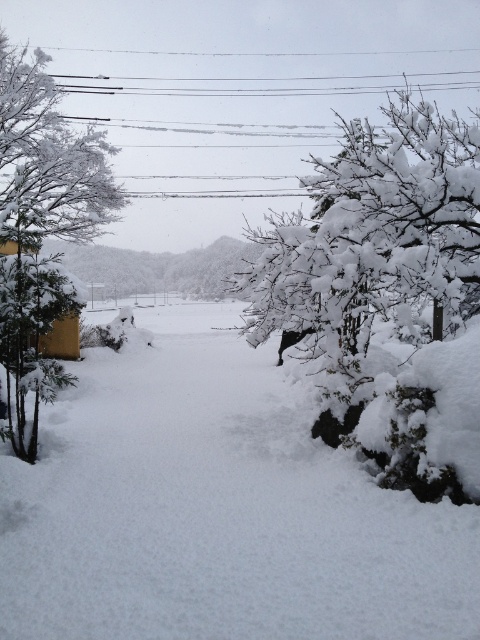
Where is `white fluffy snow at center`? The image size is (480, 640). white fluffy snow at center is located at coordinates (216, 509).

Does white fluffy snow at center have a smaller size compared to white frosty tree at left?

Correct, white fluffy snow at center occupies less space than white frosty tree at left.

Identify the location of white fluffy snow at center. The height and width of the screenshot is (640, 480). (216, 509).

This screenshot has width=480, height=640. I want to click on white fluffy snow at center, so click(216, 509).

Which is below, white fluffy snow at center or white frosty tree at right?

white fluffy snow at center is below.

The image size is (480, 640). I want to click on white fluffy snow at center, so click(216, 509).

Measure the distance between white frosty tree at right and white frosty tree at left.

white frosty tree at right is 7.41 meters from white frosty tree at left.

Between white frosty tree at right and white frosty tree at left, which one is positioned lower?

Positioned lower is white frosty tree at left.

Where is `white frosty tree at right`? Image resolution: width=480 pixels, height=640 pixels. white frosty tree at right is located at coordinates (386, 292).